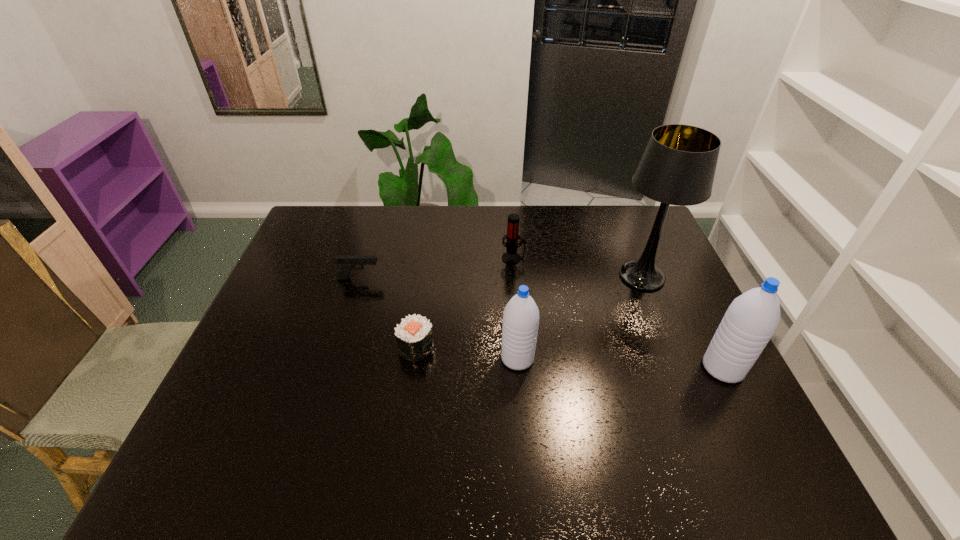
Please point out where to position a new water bottle on the left to maintain spacing. Please provide its 2D coordinates. Your answer should be formatted as a tuple, i.e. [(x, y)], where the tuple contains the x and y coordinates of a point satisfying the conditions above.

[(321, 349)]